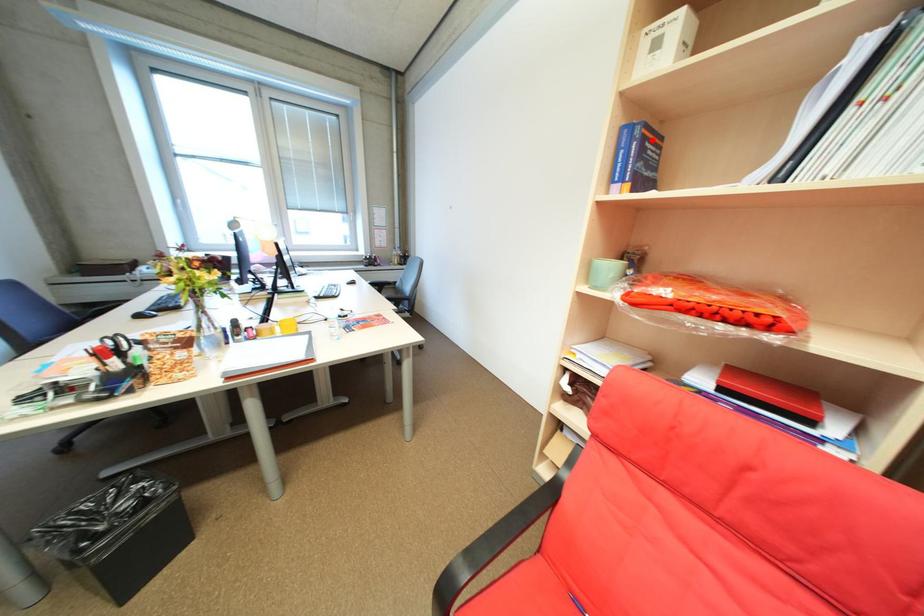
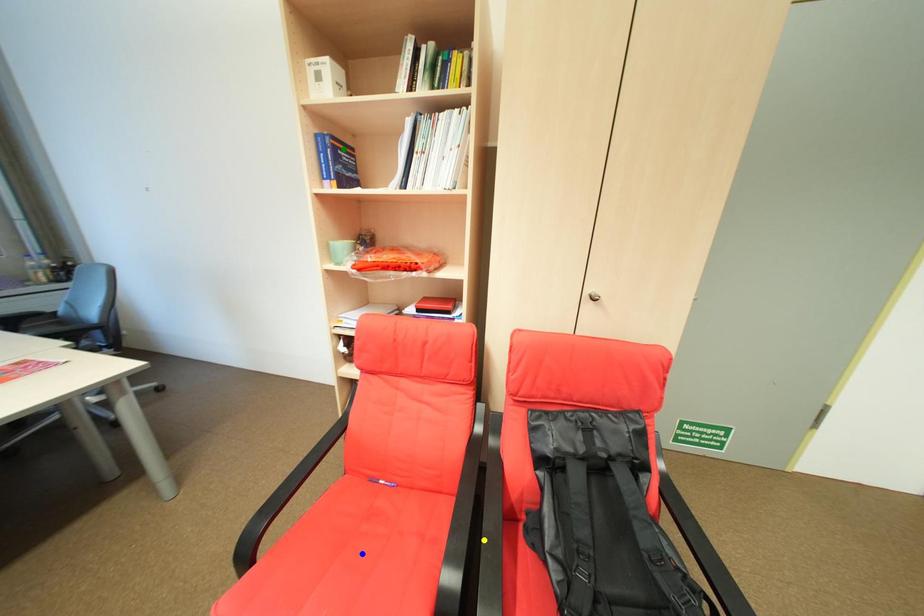
Question: I am providing you with two images of the same scene from different viewpoints. A red point is marked on the first image. You are given multiple points on the second image. In image 2, which mark is for the same physical point as the one in image 1?

Choices:
 (A) blue point
 (B) yellow point
 (C) green point

Answer: (C)